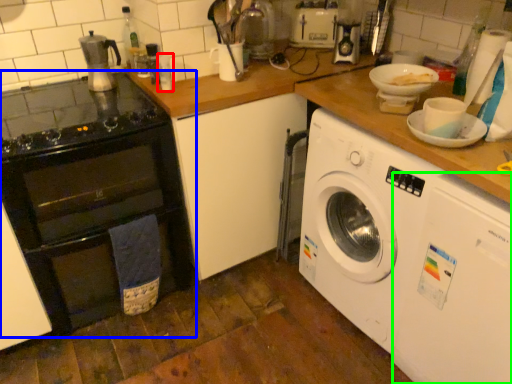
Question: Which is nearer to the bottle (highlighted by a red box)? oven (highlighted by a blue box) or washing machine (highlighted by a green box).

Choices:
 (A) oven
 (B) washing machine

Answer: (A)